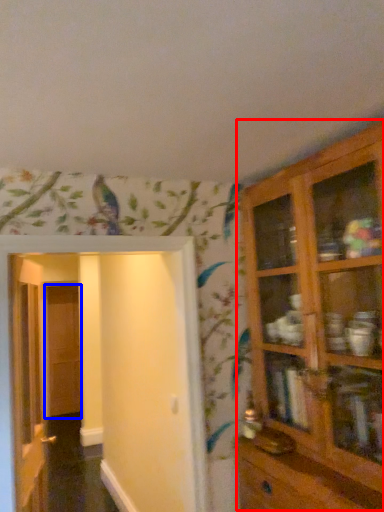
Question: Which object appears farthest to the camera in this image, cupboard (highlighted by a red box) or door (highlighted by a blue box)?

Choices:
 (A) cupboard
 (B) door

Answer: (B)